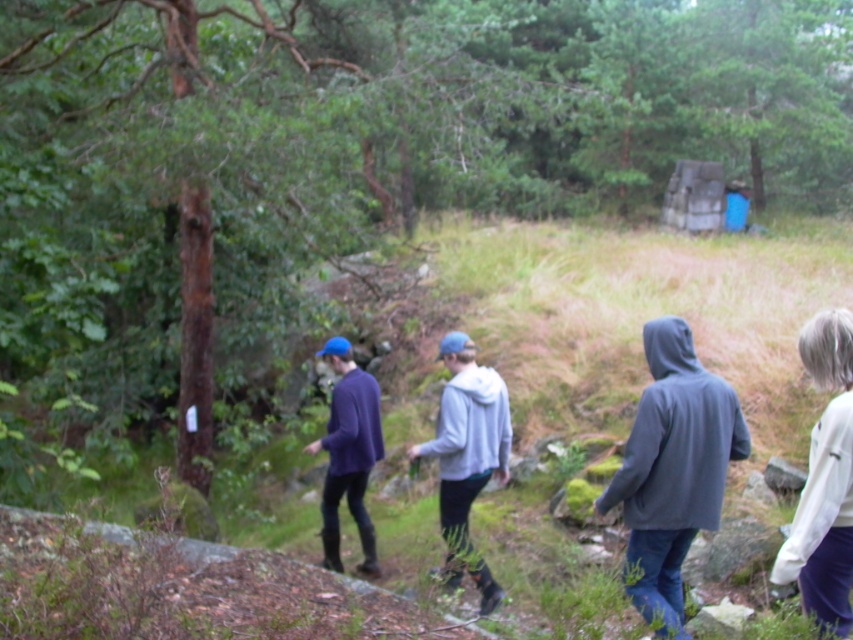
Question: Does dark gray hoodie at center have a smaller size compared to white soft sweater at right?

Choices:
 (A) yes
 (B) no

Answer: (B)

Question: Which object is farther from the camera taking this photo?

Choices:
 (A) gray hoodie at center
 (B) white soft sweater at right
 (C) dark gray hoodie at center
 (D) matte purple sweater at center

Answer: (D)

Question: Does white soft sweater at right have a smaller size compared to gray hoodie at center?

Choices:
 (A) no
 (B) yes

Answer: (B)

Question: Which point is closer to the camera taking this photo?

Choices:
 (A) click(x=485, y=579)
 (B) click(x=657, y=548)
 (C) click(x=376, y=433)

Answer: (B)

Question: Which object appears farthest from the camera in this image?

Choices:
 (A) matte purple sweater at center
 (B) gray hoodie at center

Answer: (A)

Question: Can you confirm if dark gray hoodie at center is positioned below matte purple sweater at center?

Choices:
 (A) no
 (B) yes

Answer: (A)